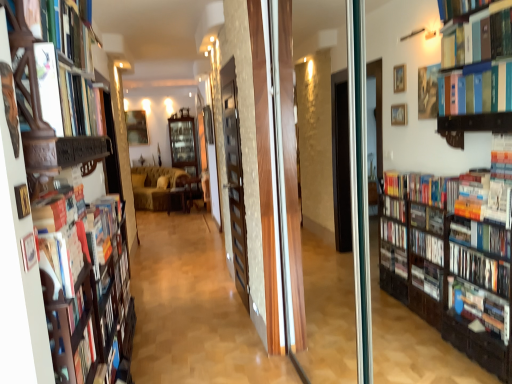
This screenshot has height=384, width=512. I want to click on free spot to the left of wooden screen door at center, so click(208, 299).